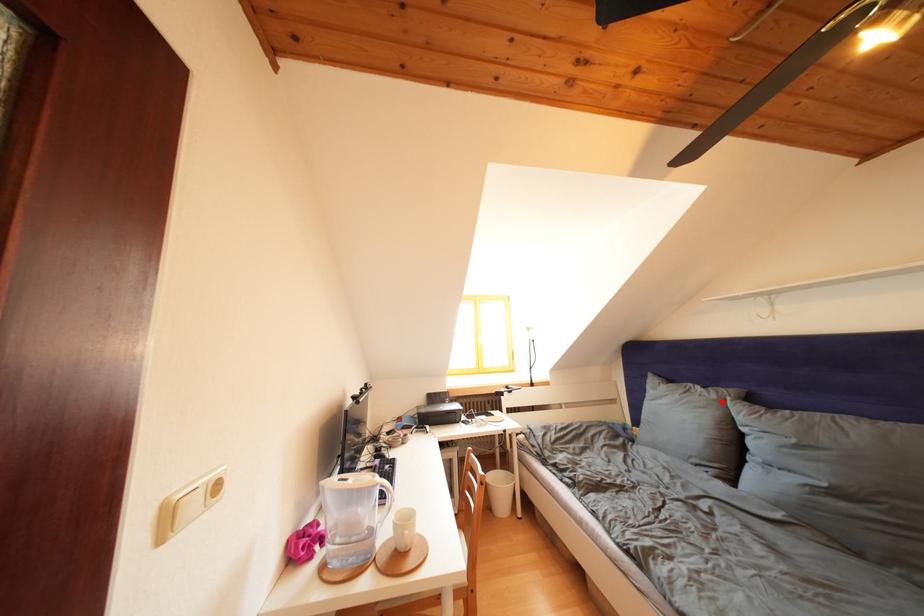
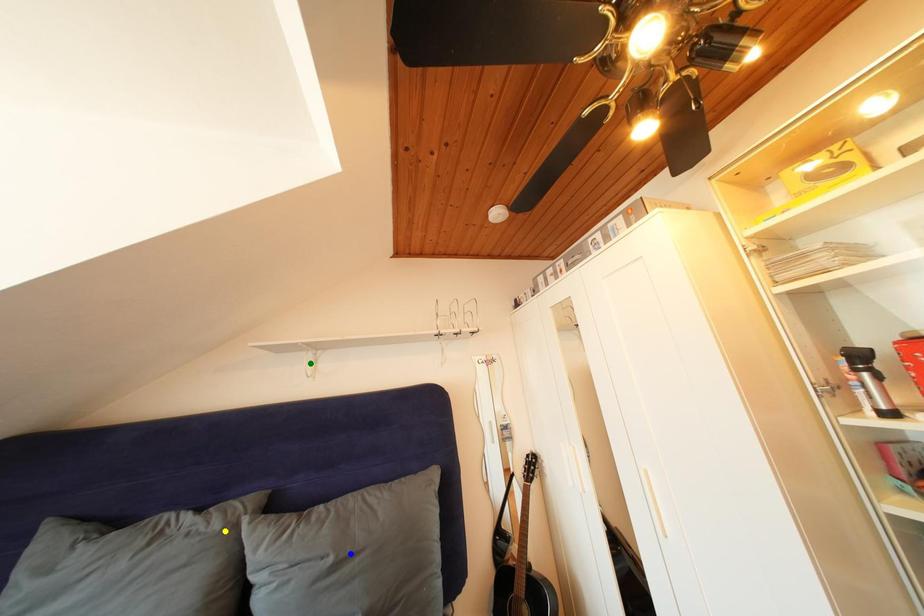
Question: I am providing you with two images of the same scene from different viewpoints. A red point is marked on the first image. You are given multiple points on the second image. Which point in image 2 represents the same 3d spot as the red point in image 1?

Choices:
 (A) blue point
 (B) green point
 (C) yellow point

Answer: (C)